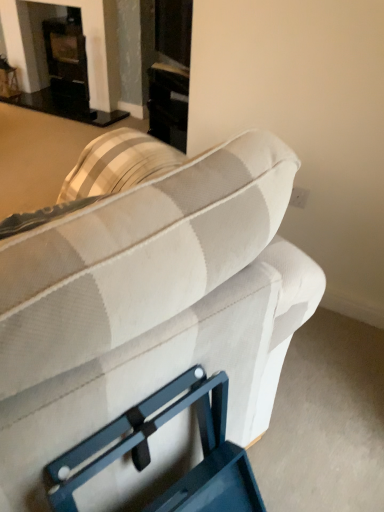
Question: Considering the relative positions of beige fabric couch at center and black glass fireplace at upper left in the image provided, is beige fabric couch at center to the left or to the right of black glass fireplace at upper left?

Choices:
 (A) left
 (B) right

Answer: (B)

Question: From a real-world perspective, relative to black glass fireplace at upper left, is beige fabric couch at center vertically above or below?

Choices:
 (A) below
 (B) above

Answer: (B)

Question: From the image's perspective, relative to black glass fireplace at upper left, is beige fabric couch at center above or below?

Choices:
 (A) below
 (B) above

Answer: (A)

Question: Is black glass fireplace at upper left inside or outside of beige fabric couch at center?

Choices:
 (A) inside
 (B) outside

Answer: (B)

Question: From a real-world perspective, is black glass fireplace at upper left positioned above or below beige fabric couch at center?

Choices:
 (A) below
 (B) above

Answer: (A)

Question: Looking at their shapes, would you say black glass fireplace at upper left is wider or thinner than beige fabric couch at center?

Choices:
 (A) thin
 (B) wide

Answer: (A)

Question: Is black glass fireplace at upper left bigger or smaller than beige fabric couch at center?

Choices:
 (A) small
 (B) big

Answer: (A)